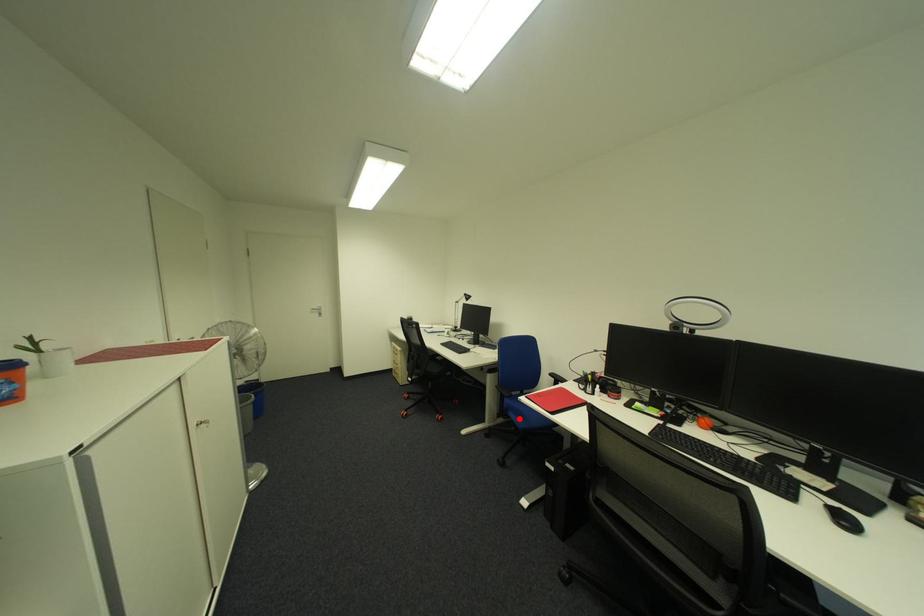
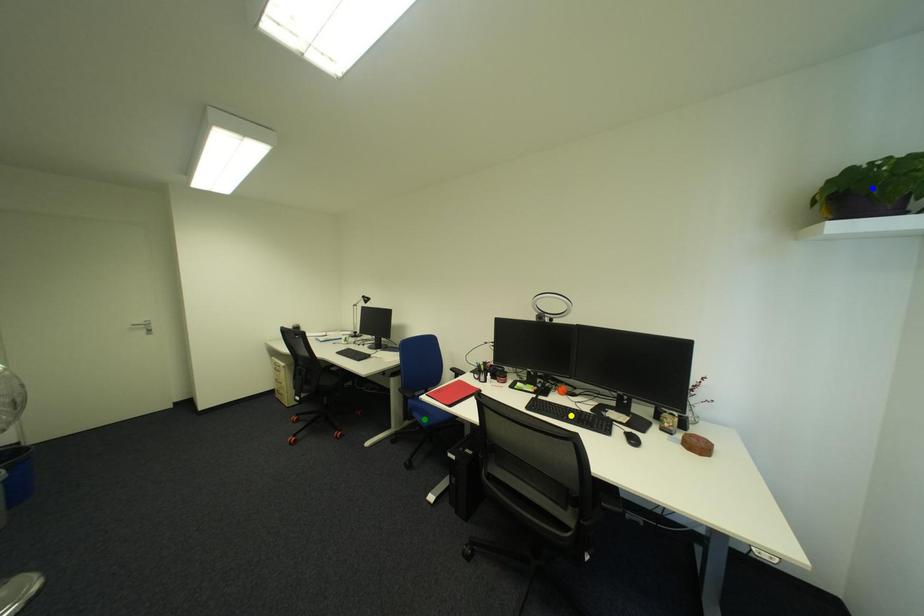
Question: I am providing you with two images of the same scene from different viewpoints. A red point is marked on the first image. You are given multiple points on the second image. In image 2, which mark is for the same physical point as the one in image 1?

Choices:
 (A) blue point
 (B) yellow point
 (C) green point

Answer: (C)